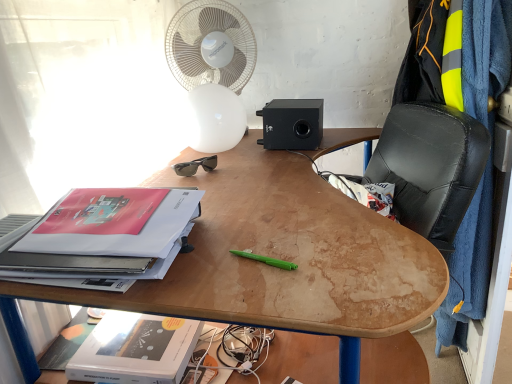
Question: From a real-world perspective, is wooden desk at center positioned under white matte paperback book at lower left, the 1th paperback book ordered from the bottom, based on gravity?

Choices:
 (A) no
 (B) yes

Answer: (B)

Question: From a real-world perspective, is wooden desk at center physically above white matte paperback book at lower left, the second paperback book when ordered from top to bottom?

Choices:
 (A) yes
 (B) no

Answer: (B)

Question: From the image's perspective, is wooden desk at center under white matte paperback book at lower left, the 1th paperback book ordered from the bottom?

Choices:
 (A) yes
 (B) no

Answer: (B)

Question: Does wooden desk at center have a lesser width compared to white matte paperback book at lower left, the 1th paperback book ordered from the bottom?

Choices:
 (A) yes
 (B) no

Answer: (B)

Question: Is wooden desk at center oriented towards white matte paperback book at lower left, the 1th paperback book ordered from the bottom?

Choices:
 (A) yes
 (B) no

Answer: (B)

Question: Can we say wooden desk at center lies outside white matte paperback book at lower left, the second paperback book when ordered from top to bottom?

Choices:
 (A) no
 (B) yes

Answer: (B)

Question: From the image's perspective, does white matte paperback book at lower left, the second paperback book when ordered from top to bottom, appear lower than wooden desk at center?

Choices:
 (A) no
 (B) yes

Answer: (B)

Question: From a real-world perspective, is white matte paperback book at lower left, the 1th paperback book ordered from the bottom, on top of wooden desk at center?

Choices:
 (A) yes
 (B) no

Answer: (A)

Question: Is white matte paperback book at lower left, the 1th paperback book ordered from the bottom, further to the viewer compared to wooden desk at center?

Choices:
 (A) yes
 (B) no

Answer: (A)

Question: Can you confirm if white matte paperback book at lower left, the 1th paperback book ordered from the bottom, is bigger than wooden desk at center?

Choices:
 (A) no
 (B) yes

Answer: (A)

Question: From a real-world perspective, is white matte paperback book at lower left, the 1th paperback book ordered from the bottom, positioned under wooden desk at center based on gravity?

Choices:
 (A) no
 (B) yes

Answer: (A)

Question: Would you consider white matte paperback book at lower left, the second paperback book when ordered from top to bottom, to be distant from wooden desk at center?

Choices:
 (A) yes
 (B) no

Answer: (B)

Question: Is black leather computer chair at center oriented towards black plastic sunglasses at upper center?

Choices:
 (A) no
 (B) yes

Answer: (B)